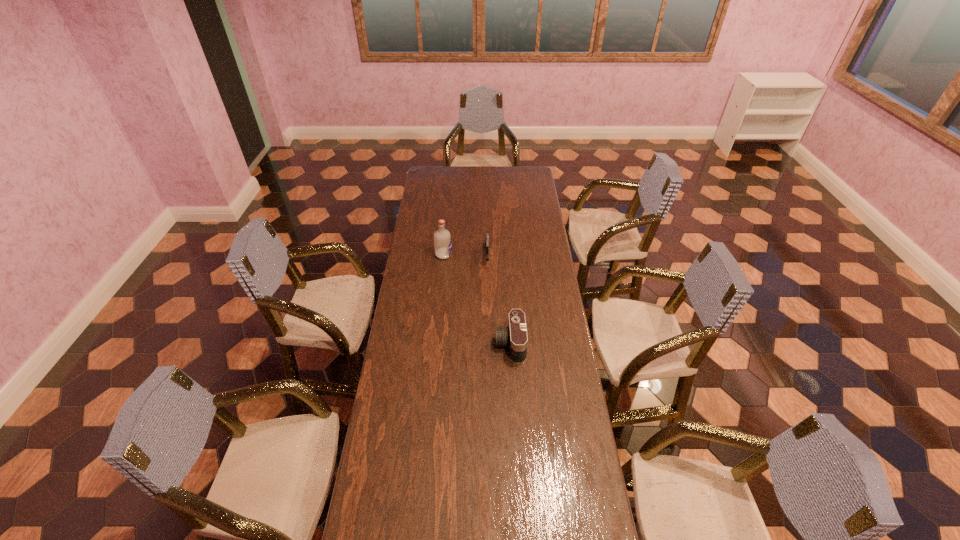
This screenshot has height=540, width=960. Identify the location of the leftmost object. (442, 239).

The width and height of the screenshot is (960, 540). In order to click on vodka in this screenshot , I will do (x=442, y=239).

Where is `the nearest object`? Image resolution: width=960 pixels, height=540 pixels. the nearest object is located at coordinates (514, 336).

In order to click on the second shortest object in this screenshot , I will do `click(514, 336)`.

The image size is (960, 540). What are the coordinates of `the second object from left to right` in the screenshot? It's located at (487, 248).

Find the location of a particular element. the shortest object is located at coordinates (487, 248).

At what (x,y) coordinates should I click in order to perform the action: click on vacant space situated 0.140m on the label of the vodka. Please return your answer as a coordinate pair (x, y). Looking at the image, I should click on (479, 255).

Find the location of a particular element. free space located 0.070m on the front-facing side of the rightmost object is located at coordinates (478, 344).

Find the location of a particular element. vacant space located 0.180m on the front-facing side of the rightmost object is located at coordinates pos(452,344).

Where is `vacant space located on the front-facing side of the rightmost object`? vacant space located on the front-facing side of the rightmost object is located at coordinates (450, 344).